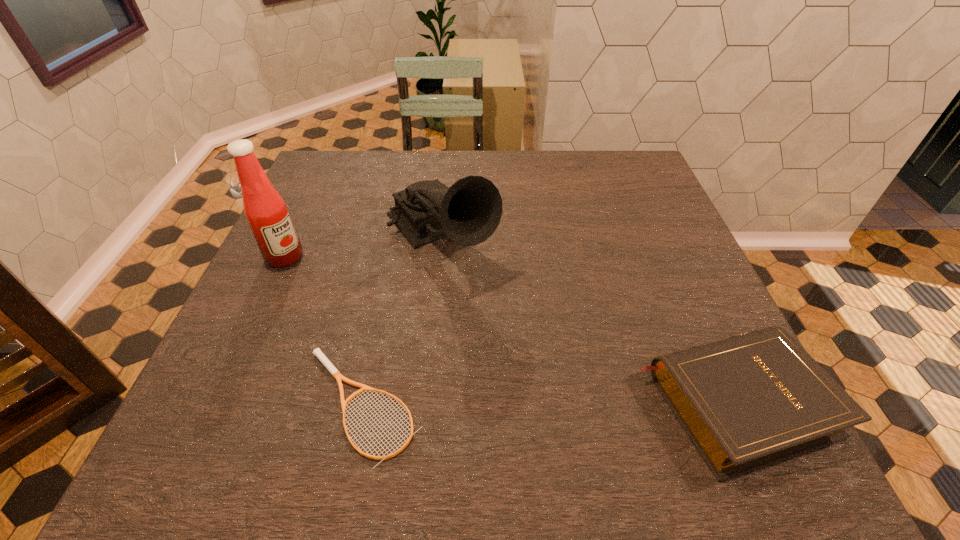
The height and width of the screenshot is (540, 960). What are the coordinates of `vacant area situated from the horn of the second tallest object` in the screenshot? It's located at (525, 348).

Where is `free location located 0.350m from the horn of the second tallest object`? Image resolution: width=960 pixels, height=540 pixels. free location located 0.350m from the horn of the second tallest object is located at coordinates (571, 402).

The image size is (960, 540). I want to click on vacant space located from the horn of the second tallest object, so click(484, 300).

Find the location of `tennis racket positioned at the near edge`. tennis racket positioned at the near edge is located at coordinates pos(330,367).

Where is `Bible present at the near edge`? The width and height of the screenshot is (960, 540). Bible present at the near edge is located at coordinates (748, 401).

You are a GUI agent. You are given a task and a screenshot of the screen. Output one action in this format:
    pyautogui.click(x=<x>, y=<y>)
    Task: Click on the object that is at the left edge
    The height and width of the screenshot is (540, 960).
    Given the screenshot: What is the action you would take?
    pyautogui.click(x=266, y=212)

Identify the location of object that is at the right edge. This screenshot has height=540, width=960. (748, 401).

Locate an element on the screen. The width and height of the screenshot is (960, 540). object at the near right corner is located at coordinates (748, 401).

This screenshot has width=960, height=540. I want to click on free point at the far edge, so click(x=544, y=165).

Image resolution: width=960 pixels, height=540 pixels. Find the location of `blank space at the near edge`. blank space at the near edge is located at coordinates (306, 403).